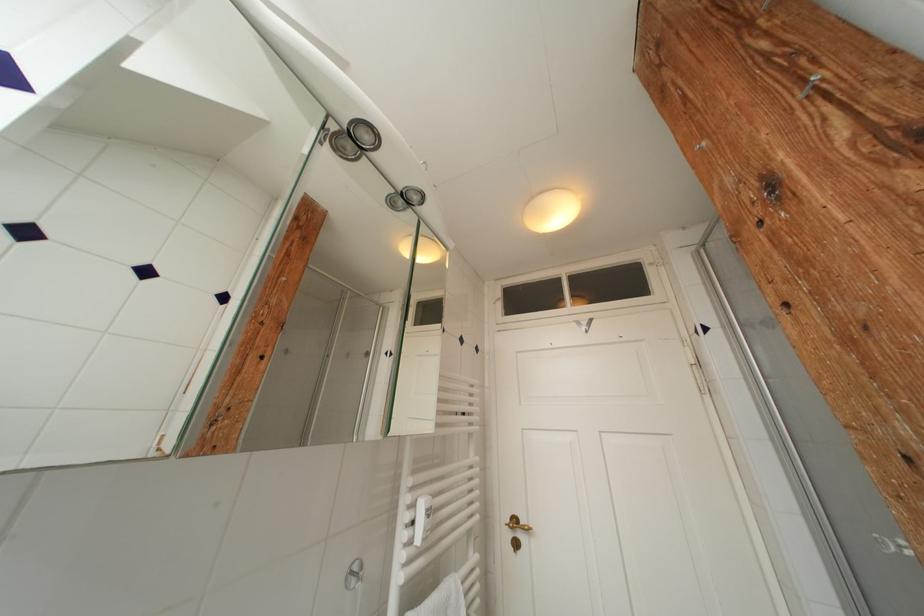
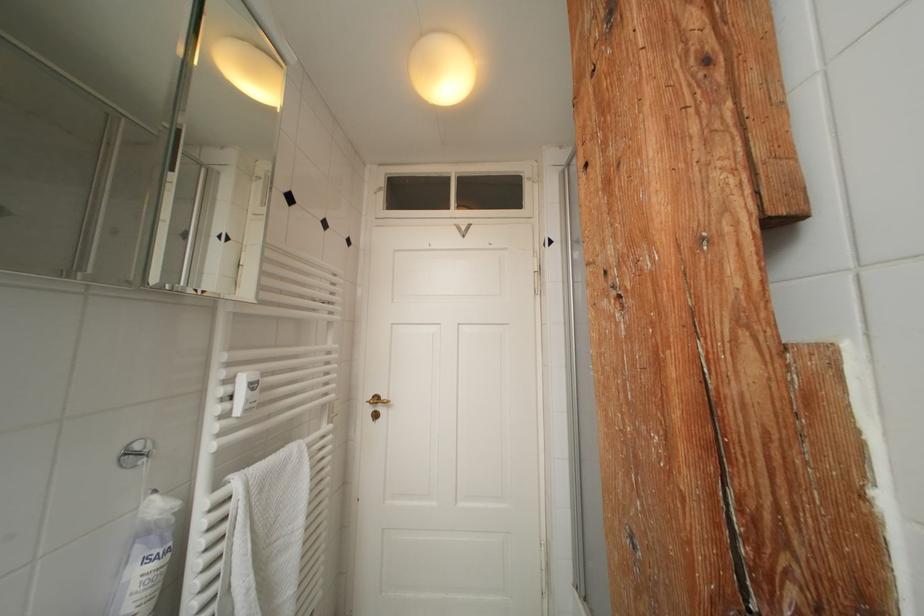
Question: Which direction would the cameraman need to move to produce the second image? Reply with the corresponding letter.

Choices:
 (A) Left
 (B) Right
 (C) Forward
 (D) Backward

Answer: (B)